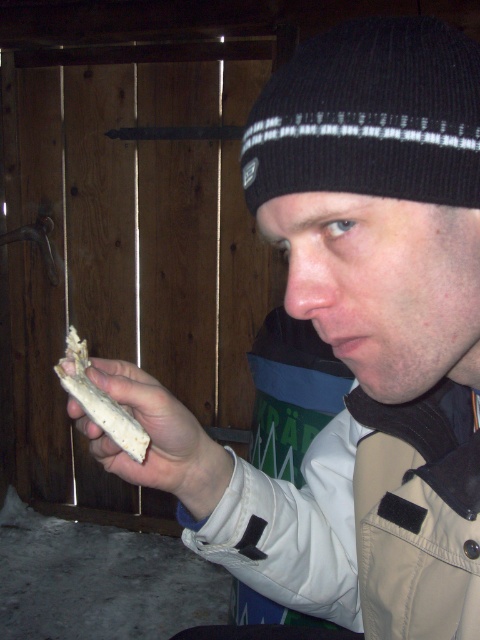
Does black knit beanie at upper center appear over white crumbly bread at center?

Yes.

Who is positioned more to the left, black knit beanie at upper center or white crumbly bread at center?

Positioned to the left is white crumbly bread at center.

Image resolution: width=480 pixels, height=640 pixels. What do you see at coordinates (370, 116) in the screenshot?
I see `black knit beanie at upper center` at bounding box center [370, 116].

At what (x,y) coordinates should I click in order to perform the action: click on black knit beanie at upper center. Please return your answer as a coordinate pair (x, y). The width and height of the screenshot is (480, 640). Looking at the image, I should click on (370, 116).

Who is lower down, black knit beanie at upper center or light brown leather hand at center?

light brown leather hand at center

Is black knit beanie at upper center above light brown leather hand at center?

Correct, black knit beanie at upper center is located above light brown leather hand at center.

Locate an element on the screen. This screenshot has height=640, width=480. black knit beanie at upper center is located at coordinates (370, 116).

You are a GUI agent. You are given a task and a screenshot of the screen. Output one action in this format:
    pyautogui.click(x=<x>, y=<y>)
    Task: Click on the black knit beanie at upper center
    The width and height of the screenshot is (480, 640).
    Given the screenshot: What is the action you would take?
    pyautogui.click(x=370, y=116)

Is light brown leather hand at center behind white crumbly bread at center?

That is True.

Which is in front, point (136, 372) or point (93, 385)?

Point (93, 385)

This screenshot has width=480, height=640. What are the coordinates of `light brown leather hand at center` in the screenshot? It's located at pyautogui.click(x=148, y=432).

Locate an element on the screen. light brown leather hand at center is located at coordinates tap(148, 432).